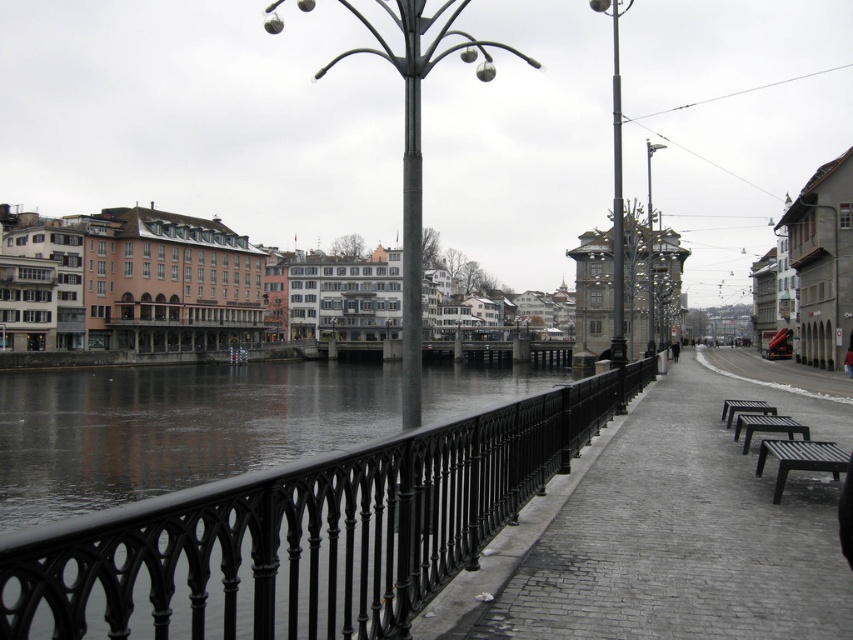
Question: Considering the relative positions of black brick pavement at center and black metal bench at center right in the image provided, where is black brick pavement at center located with respect to black metal bench at center right?

Choices:
 (A) below
 (B) above

Answer: (A)

Question: Which is nearer to the black metal bench at lower right?

Choices:
 (A) metallic gray lamp post at right
 (B) black metal bench at center right
 (C) polished metal pole at center
 (D) metallic pole at center

Answer: (B)

Question: Is black brick pavement at center to the left of polished metal pole at center from the viewer's perspective?

Choices:
 (A) yes
 (B) no

Answer: (A)

Question: Which point is closer to the camera?

Choices:
 (A) (647, 246)
 (B) (798, 566)

Answer: (B)

Question: Which point is farther to the camera?

Choices:
 (A) black brick pavement at center
 (B) black metal bench at lower right

Answer: (B)

Question: Is metallic gray pole at center below black metal bench at lower right?

Choices:
 (A) no
 (B) yes

Answer: (A)